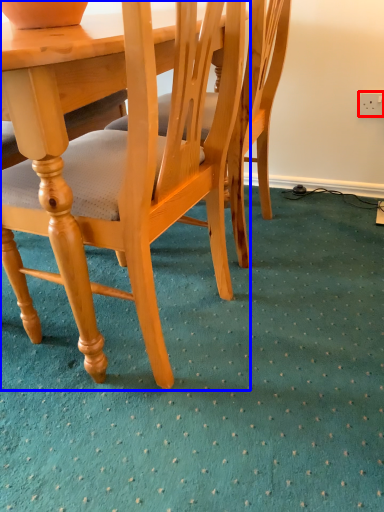
Question: Which of the following is the closest to the observer, power outlet (highlighted by a red box) or chair (highlighted by a blue box)?

Choices:
 (A) power outlet
 (B) chair

Answer: (B)